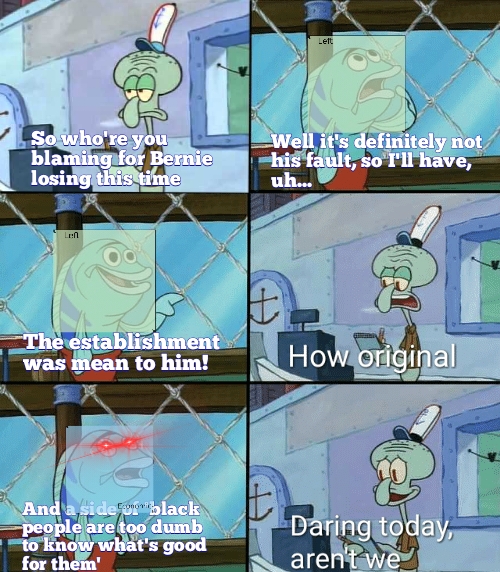
This screenshot has width=500, height=572. Identify the location of anchor on wall. coord(255,495), coord(263,300), coord(6,114).